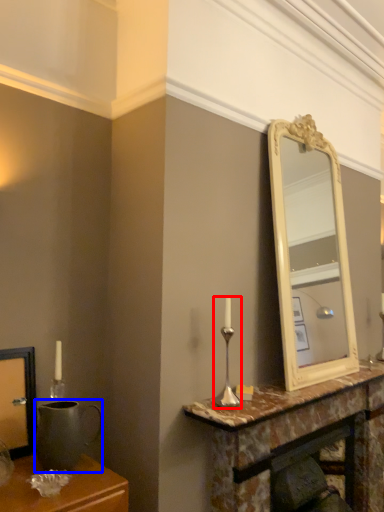
Question: Which object is closer to the camera taking this photo, candle holder (highlighted by a red box) or gray (highlighted by a blue box)?

Choices:
 (A) candle holder
 (B) gray

Answer: (B)